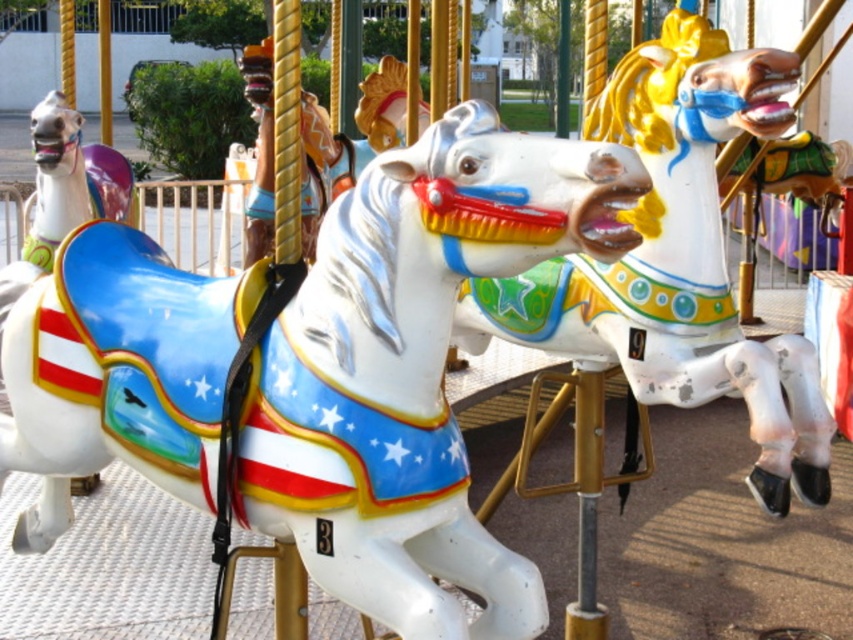
Question: Which object is positioned farthest from the white glossy horse at center?

Choices:
 (A) painted wood horse at center
 (B) shiny white horse at left

Answer: (B)

Question: Which point appears farthest from the camera in this image?

Choices:
 (A) (105, 193)
 (B) (74, 432)

Answer: (A)

Question: Where is white glossy horse at center located in relation to shiny white horse at left in the image?

Choices:
 (A) above
 (B) below

Answer: (B)

Question: From the image, what is the correct spatial relationship of painted wood horse at center in relation to shiny white horse at left?

Choices:
 (A) right
 (B) left

Answer: (A)

Question: Which point is farther to the camera?

Choices:
 (A) painted wood horse at center
 (B) white glossy horse at center

Answer: (A)

Question: Does painted wood horse at center have a larger size compared to shiny white horse at left?

Choices:
 (A) no
 (B) yes

Answer: (B)